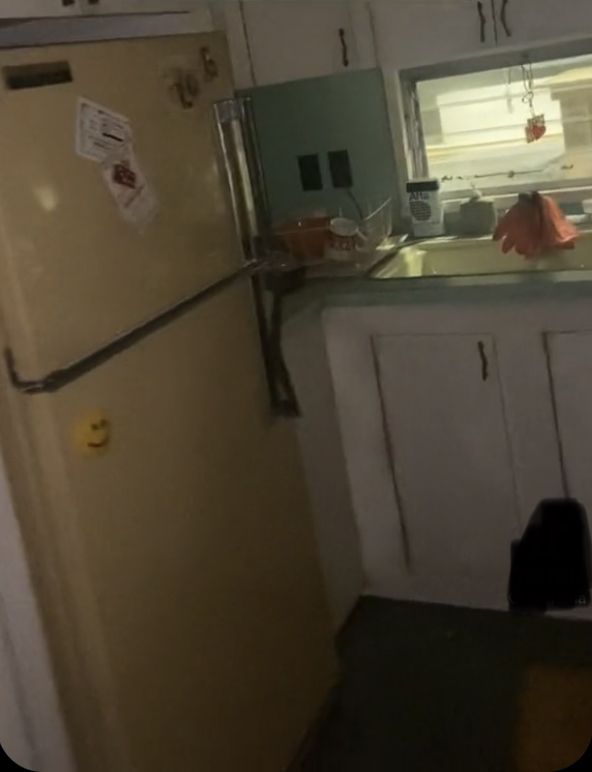
I want to click on handles, so click(276, 374), click(479, 363), click(234, 178), click(341, 53), click(481, 31), click(513, 22), click(67, 5).